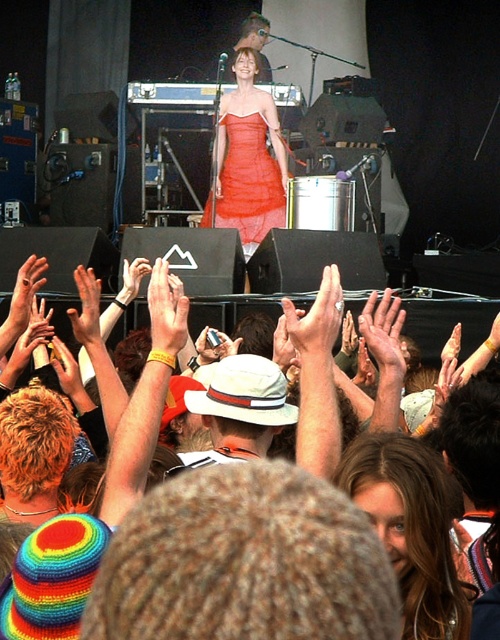
Is blonde hair at center below smooth skin hand at center?

Yes, blonde hair at center is below smooth skin hand at center.

Locate an element on the screen. blonde hair at center is located at coordinates (410, 528).

Can you confirm if translucent orange dress at center is wider than smooth skin hand at center?

Yes.

Can you confirm if translucent orange dress at center is positioned above smooth skin hand at center?

Correct, translucent orange dress at center is located above smooth skin hand at center.

Describe the element at coordinates (249, 180) in the screenshot. I see `translucent orange dress at center` at that location.

At what (x,y) coordinates should I click in order to perform the action: click on translucent orange dress at center. Please return your answer as a coordinate pair (x, y). This screenshot has width=500, height=640. Looking at the image, I should click on (249, 180).

Is translucent orange dress at center to the left of light brown leather hand at upper center from the viewer's perspective?

In fact, translucent orange dress at center is to the right of light brown leather hand at upper center.

Does translucent orange dress at center lie in front of light brown leather hand at upper center?

No, it is not.

Between point (243, 131) and point (80, 285), which one is positioned in front?

Point (80, 285) is more forward.

At what (x,y) coordinates should I click in order to perform the action: click on translucent orange dress at center. Please return your answer as a coordinate pair (x, y). Looking at the image, I should click on (249, 180).